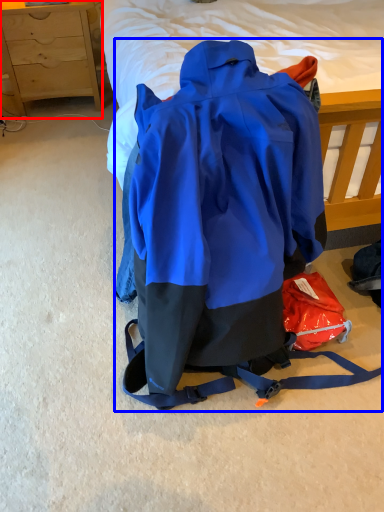
Question: Which object appears farthest to the camera in this image, chest of drawers (highlighted by a red box) or backpack (highlighted by a blue box)?

Choices:
 (A) chest of drawers
 (B) backpack

Answer: (A)